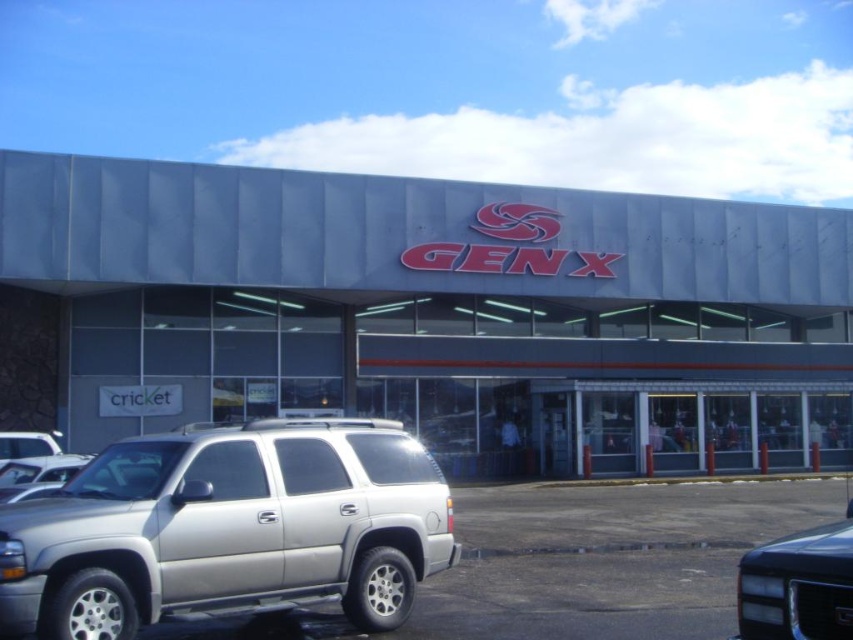
Question: Considering the real-world distances, which object is farthest from the silver metallic minivan at lower left?

Choices:
 (A) gray metallic storefront at center
 (B) shiny black suv at lower right

Answer: (A)

Question: Which point is closer to the camera?

Choices:
 (A) gray metallic storefront at center
 (B) shiny black suv at lower right

Answer: (B)

Question: Is gray metallic storefront at center below shiny black suv at lower right?

Choices:
 (A) no
 (B) yes

Answer: (A)

Question: Where is gray metallic storefront at center located in relation to shiny black suv at lower right in the image?

Choices:
 (A) right
 (B) left

Answer: (B)

Question: Does silver metallic minivan at lower left lie in front of shiny black suv at lower right?

Choices:
 (A) yes
 (B) no

Answer: (B)

Question: Which point is farther from the camera taking this photo?

Choices:
 (A) (257, 582)
 (B) (792, 600)

Answer: (A)